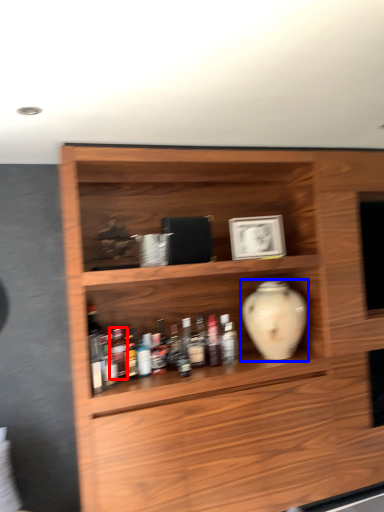
Question: Which object appears closest to the camera in this image, bottle (highlighted by a red box) or vase (highlighted by a blue box)?

Choices:
 (A) bottle
 (B) vase

Answer: (A)